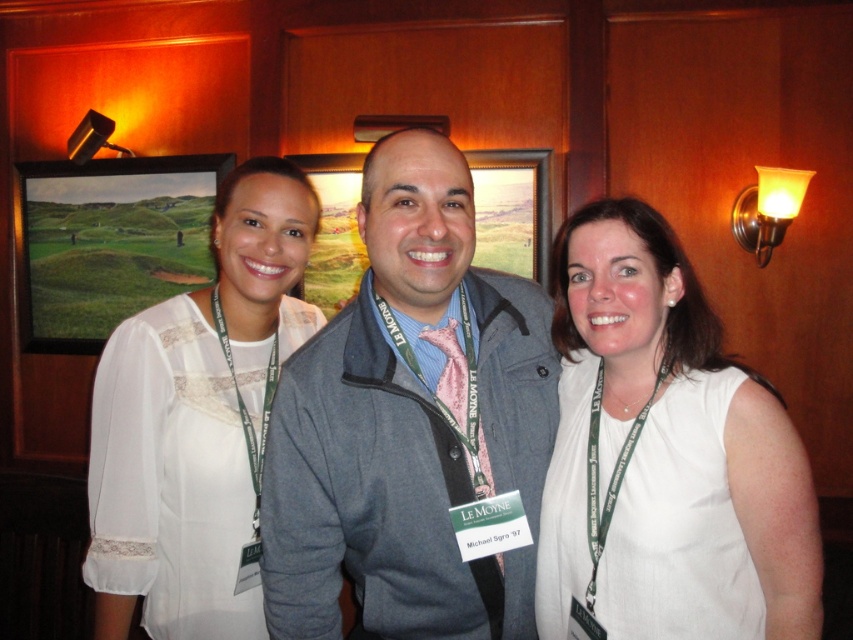
Question: Which point is farther to the camera?

Choices:
 (A) (192, 243)
 (B) (178, 577)

Answer: (A)

Question: Among these objects, which one is farthest from the camera?

Choices:
 (A) green matte picture frame at upper left
 (B) gray fabric jacket at center

Answer: (A)

Question: Which point is farther from the camera taking this photo?

Choices:
 (A) (280, 620)
 (B) (283, 273)

Answer: (B)

Question: Does green matte picture frame at upper left lie behind wooden picture frame at center?

Choices:
 (A) no
 (B) yes

Answer: (B)

Question: In this image, where is white fabric shirt at center located relative to white lace blouse at left?

Choices:
 (A) left
 (B) right

Answer: (B)

Question: Is white lace blouse at left positioned before green matte picture frame at upper left?

Choices:
 (A) no
 (B) yes

Answer: (B)